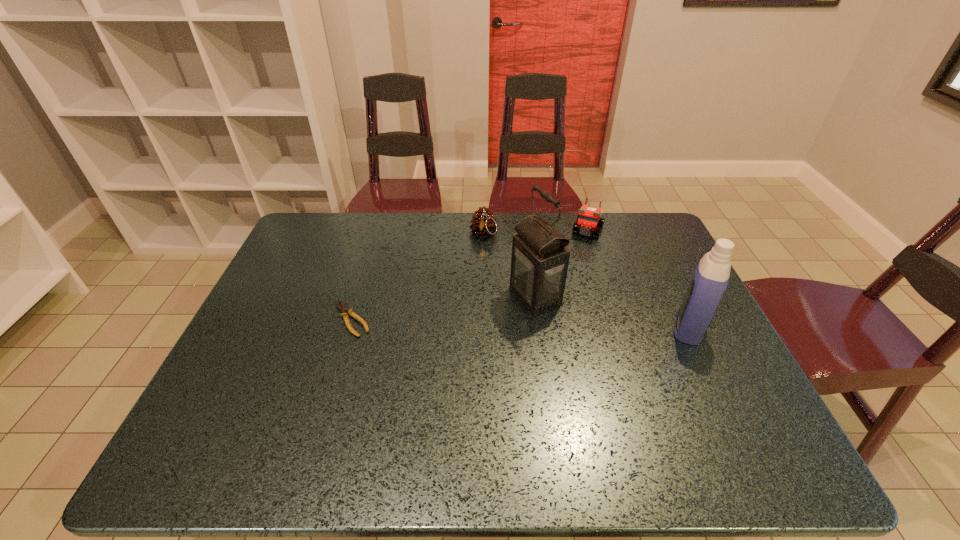
I want to click on the shortest object, so click(343, 308).

This screenshot has width=960, height=540. Find the location of `pliers`. pliers is located at coordinates (343, 308).

Locate an element on the screen. This screenshot has width=960, height=540. detergent is located at coordinates (711, 277).

You are a GUI agent. You are given a task and a screenshot of the screen. Output one action in this format:
    pyautogui.click(x=<x>, y=<y>)
    Task: Click on the second tallest object
    This screenshot has height=540, width=960.
    Given the screenshot: What is the action you would take?
    pyautogui.click(x=711, y=277)

Locate an element on the screen. This screenshot has width=960, height=540. the second object from right to left is located at coordinates (588, 221).

You are a GUI agent. You are given a task and a screenshot of the screen. Output one action in this format:
    pyautogui.click(x=<x>, y=<y>)
    Task: Click on the lantern
    This screenshot has width=960, height=540.
    Given the screenshot: What is the action you would take?
    pyautogui.click(x=539, y=263)

In order to click on the third object from right to left in this screenshot , I will do `click(539, 263)`.

Find the location of a particular element. The width and height of the screenshot is (960, 540). the fourth object from right to left is located at coordinates (483, 223).

The width and height of the screenshot is (960, 540). Identify the location of free space located 0.090m on the front of the pliers. (337, 366).

Identify the location of vacant space situated 0.180m on the back of the detergent. This screenshot has height=540, width=960. (660, 267).